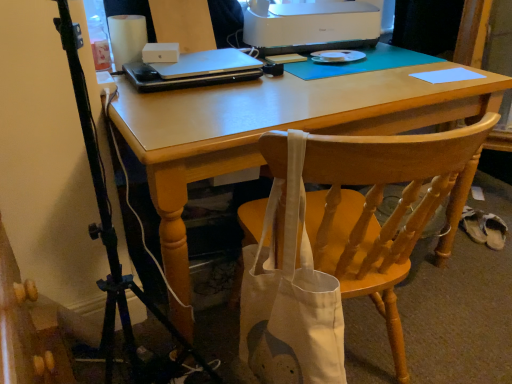
Question: Is white plastic printer at upper center wider than light blue paper at upper right?

Choices:
 (A) yes
 (B) no

Answer: (A)

Question: Is light blue paper at upper right located within white plastic printer at upper center?

Choices:
 (A) yes
 (B) no

Answer: (B)

Question: Is the depth of white plastic printer at upper center less than that of light blue paper at upper right?

Choices:
 (A) no
 (B) yes

Answer: (A)

Question: Does white plastic printer at upper center have a greater height compared to light blue paper at upper right?

Choices:
 (A) no
 (B) yes

Answer: (B)

Question: Is white plastic printer at upper center to the left of light blue paper at upper right from the viewer's perspective?

Choices:
 (A) no
 (B) yes

Answer: (B)

Question: Considering the relative positions of white plastic printer at upper center and light blue paper at upper right in the image provided, is white plastic printer at upper center to the right of light blue paper at upper right from the viewer's perspective?

Choices:
 (A) yes
 (B) no

Answer: (B)

Question: Does white fabric shoe at lower right appear on the left side of wooden chair at center?

Choices:
 (A) yes
 (B) no

Answer: (B)

Question: Is white fabric shoe at lower right beside wooden chair at center?

Choices:
 (A) no
 (B) yes

Answer: (A)

Question: Does white fabric shoe at lower right lie behind wooden chair at center?

Choices:
 (A) yes
 (B) no

Answer: (A)

Question: From a real-world perspective, is white fabric shoe at lower right on top of wooden chair at center?

Choices:
 (A) no
 (B) yes

Answer: (A)

Question: From a real-world perspective, is white fabric shoe at lower right located beneath wooden chair at center?

Choices:
 (A) yes
 (B) no

Answer: (A)

Question: From the image's perspective, is white fabric shoe at lower right beneath wooden chair at center?

Choices:
 (A) yes
 (B) no

Answer: (B)

Question: Does wooden chair at center have a greater width compared to matte wooden desk at center?

Choices:
 (A) yes
 (B) no

Answer: (B)